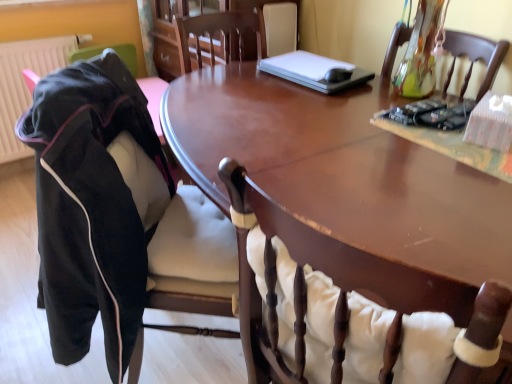
Question: Is wooden chair at center, the first chair positioned from the right, further to the viewer compared to white plastic laptop at upper center?

Choices:
 (A) no
 (B) yes

Answer: (A)

Question: Can you confirm if wooden chair at center, the first chair positioned from the right, is smaller than white plastic laptop at upper center?

Choices:
 (A) no
 (B) yes

Answer: (A)

Question: Is wooden chair at center, which ranks as the 2th chair in left-to-right order, not within white plastic laptop at upper center?

Choices:
 (A) no
 (B) yes

Answer: (B)

Question: From the image's perspective, is wooden chair at center, the first chair positioned from the right, beneath white plastic laptop at upper center?

Choices:
 (A) yes
 (B) no

Answer: (A)

Question: Is wooden chair at center, which ranks as the 2th chair in left-to-right order, positioned with its back to white plastic laptop at upper center?

Choices:
 (A) no
 (B) yes

Answer: (A)

Question: From their relative heights in the image, would you say matte plastic radiator at left is taller or shorter than glossy wood table at center?

Choices:
 (A) tall
 (B) short

Answer: (B)

Question: Looking at the image, does matte plastic radiator at left seem bigger or smaller compared to glossy wood table at center?

Choices:
 (A) big
 (B) small

Answer: (B)

Question: From a real-world perspective, is matte plastic radiator at left positioned above or below glossy wood table at center?

Choices:
 (A) above
 (B) below

Answer: (A)

Question: Considering the positions of point (19, 84) and point (458, 192), is point (19, 84) closer or farther from the camera than point (458, 192)?

Choices:
 (A) closer
 (B) farther

Answer: (B)

Question: Would you say wooden chair at center, the first chair positioned from the right, is inside or outside glossy wood table at center?

Choices:
 (A) inside
 (B) outside

Answer: (A)

Question: From a real-world perspective, is wooden chair at center, the first chair positioned from the right, above or below glossy wood table at center?

Choices:
 (A) below
 (B) above

Answer: (B)

Question: Does point (264, 244) appear closer or farther from the camera than point (440, 205)?

Choices:
 (A) farther
 (B) closer

Answer: (B)

Question: Relative to glossy wood table at center, is wooden chair at center, which ranks as the 2th chair in left-to-right order, in front or behind?

Choices:
 (A) behind
 (B) front

Answer: (B)

Question: In terms of width, does white plastic laptop at upper center look wider or thinner when compared to suede-like black jacket at left, arranged as the first chair when viewed from the left?

Choices:
 (A) wide
 (B) thin

Answer: (B)

Question: From the image's perspective, is white plastic laptop at upper center above or below suede-like black jacket at left, which is the second chair from right to left?

Choices:
 (A) above
 (B) below

Answer: (A)